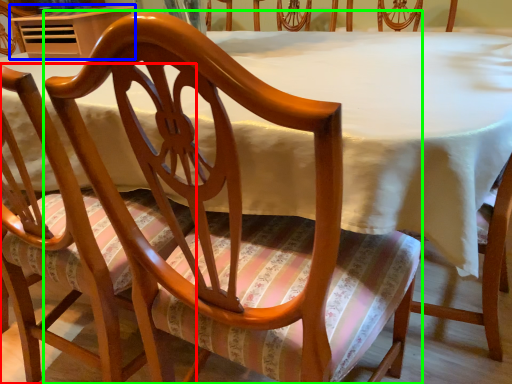
Question: Estimate the real-world distances between objects in this image. Which object is closer to chair (highlighted by a red box), table (highlighted by a blue box) or chair (highlighted by a green box)?

Choices:
 (A) table
 (B) chair

Answer: (B)